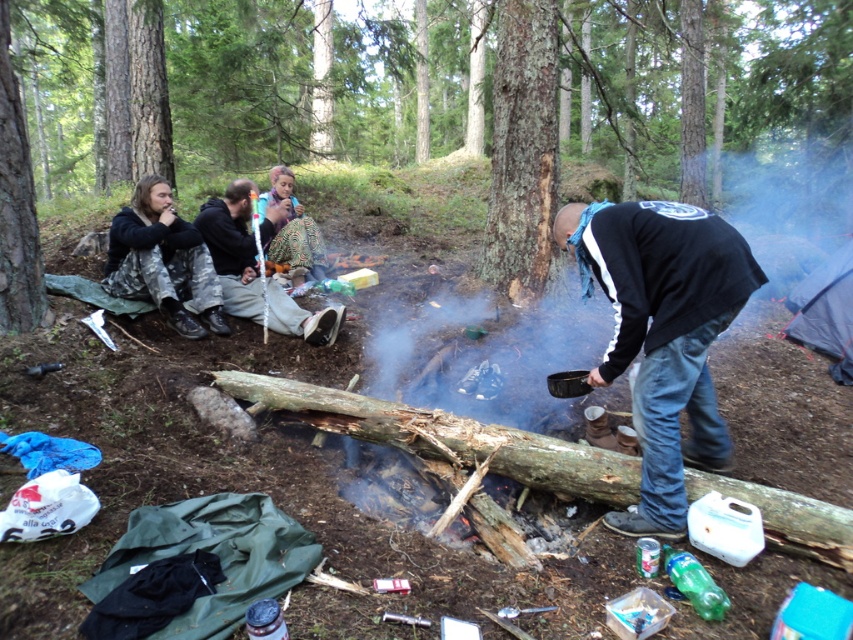
The width and height of the screenshot is (853, 640). Find the location of `camouflage fabric pants at lower left`. camouflage fabric pants at lower left is located at coordinates (233, 248).

Can you confirm if camouflage fabric pants at lower left is positioned to the right of patterned fabric skirt at center?

Correct, you'll find camouflage fabric pants at lower left to the right of patterned fabric skirt at center.

Where is `camouflage fabric pants at lower left`? Image resolution: width=853 pixels, height=640 pixels. camouflage fabric pants at lower left is located at coordinates (233, 248).

Can you confirm if blue fabric tent at right is positioned below patterned fabric skirt at center?

Yes.

Is blue fabric tent at right thinner than patterned fabric skirt at center?

Incorrect, blue fabric tent at right's width is not less than patterned fabric skirt at center's.

Image resolution: width=853 pixels, height=640 pixels. Find the location of `blue fabric tent at right`. blue fabric tent at right is located at coordinates (827, 310).

Locate an element on the screen. The width and height of the screenshot is (853, 640). blue fabric tent at right is located at coordinates (827, 310).

Can you confirm if camouflage fabric pants at lower left is positioned to the right of blue fabric tent at right?

In fact, camouflage fabric pants at lower left is to the left of blue fabric tent at right.

Is point (242, 180) positioned before point (796, 324)?

Yes, it is.

Is point (245, 305) less distant than point (843, 324)?

Yes, it is in front of point (843, 324).

This screenshot has height=640, width=853. In order to click on camouflage fabric pants at lower left in this screenshot , I will do `click(233, 248)`.